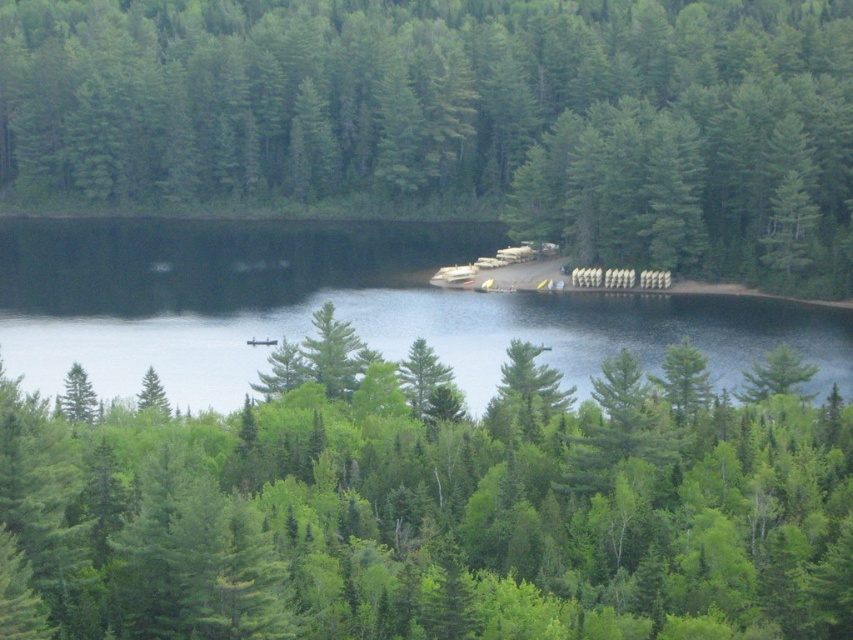
You are an environmental scientist assessing the growth patterns of trees in this forest. You observe the green matte tree at center and the green matte trees at center. Which of these has a smaller height?

The green matte tree at center is smaller than the green matte trees at center.

You are planning to take a photo of the green matte tree at center and the clear water at center. Which object should you focus on first if you want to capture both in a single frame without moving the camera?

The green matte tree at center is smaller than the clear water at center, so you should focus on the clear water at center first to ensure both objects are in sharp focus.